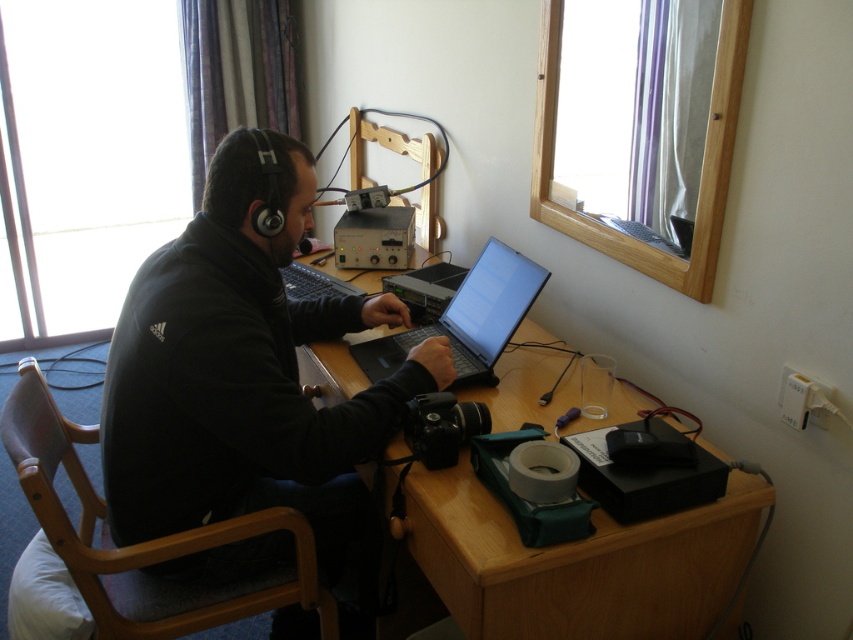
You are a delivery person who needs to place a package on the desk without disturbing any items. The package is 10 cm wide. The coordinates of the black matte jacket at center are given as point (242, 369). Is there enough space on the desk to place the package next to the black matte jacket at center?

The coordinates provided indicate the position of the black matte jacket at center, but the description does not specify the dimensions or spacing around it. Without information on the desk layout or item placements beyond the jacket, it is impossible to determine if there is sufficient space for the 10 cm package next to the black matte jacket at center.

You are a photographer setting up a shot of the desk in the hotel room. You want to focus on two specific points on the desk labeled as point 1 at coordinates point [190,266] and point 2 at coordinates point [523,296]. Which point should you adjust your focus to first if you want to capture both points in sharp detail without moving the camera?

You should focus on point 1 at coordinates point [190,266] first because it is closer to the camera than point 2 at coordinates point [523,296]. This way, you can ensure the closer point is in focus before adjusting for the farther one.

You are a delivery person who needs to pack the black matte jacket at center and the black plastic laptop at center into a box. The box has a height limit of 20 cm. If the jacket is taller than the laptop, will both items fit vertically in the box?

The black matte jacket at center is taller than the black plastic laptop at center. Since the box has a height limit of 20 cm, we need to know the exact heights of both items to determine if they can fit. However, the description only states that the jacket is taller than the laptop but doesn